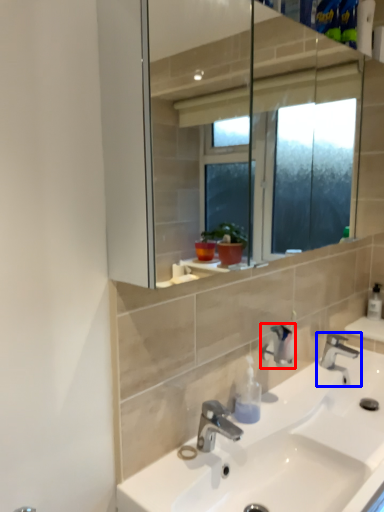
Question: Which of the following is the farthest to the observer, plumbing fixture (highlighted by a red box) or tap (highlighted by a blue box)?

Choices:
 (A) plumbing fixture
 (B) tap

Answer: (B)